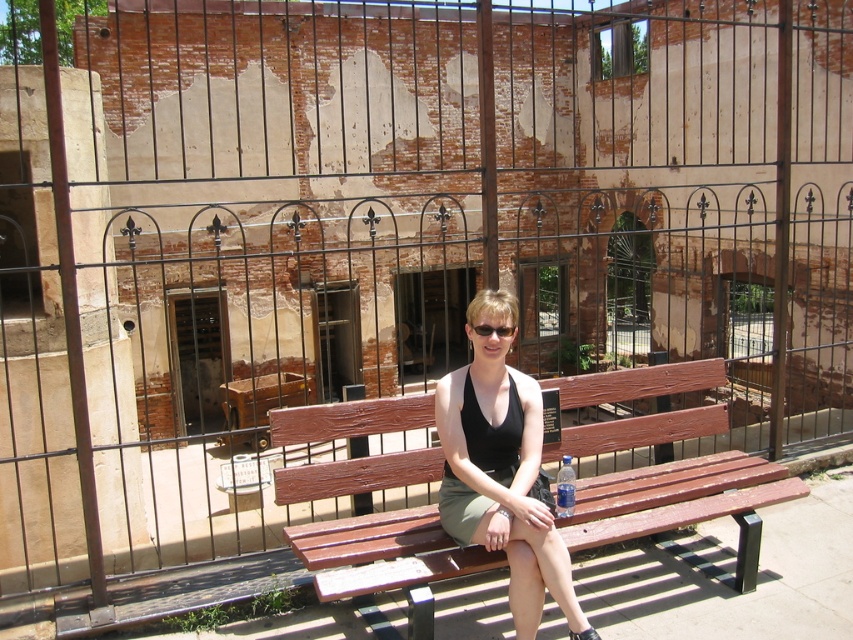
Question: Does wooden bench at center appear on the right side of black plastic goggles at center?

Choices:
 (A) yes
 (B) no

Answer: (A)

Question: Where is wooden bench at center located in relation to black plastic goggles at center in the image?

Choices:
 (A) above
 (B) below

Answer: (B)

Question: Which is farther from the wooden bench at center?

Choices:
 (A) black plastic goggles at center
 (B) black fabric tank top at center

Answer: (A)

Question: Which object is the farthest from the black fabric tank top at center?

Choices:
 (A) black plastic goggles at center
 (B) wooden bench at center

Answer: (B)

Question: In this image, where is wooden bench at center located relative to black fabric tank top at center?

Choices:
 (A) below
 (B) above

Answer: (A)

Question: Which object is farther from the camera taking this photo?

Choices:
 (A) black plastic goggles at center
 (B) wooden bench at center

Answer: (A)